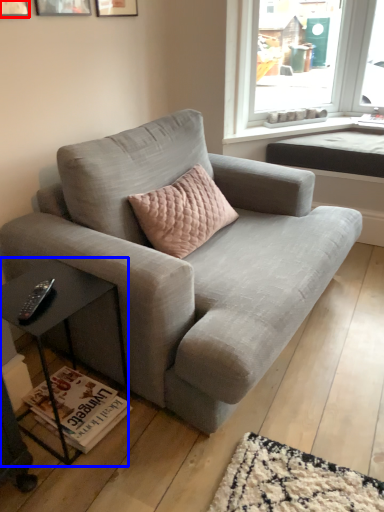
Question: Which object appears closest to the camera in this image, picture frame (highlighted by a red box) or table (highlighted by a blue box)?

Choices:
 (A) picture frame
 (B) table

Answer: (B)